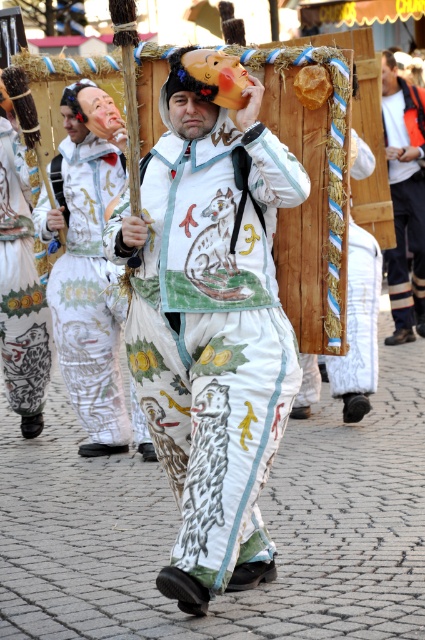
Looking at this image, you are a photographer at the festival, and you want to take a picture of the central figure in the white costume with the hooded cape. However, there is an orange reflective jacket at upper right blocking your view. Where should you move to avoid it?

Move to the lower left to avoid the orange reflective jacket at upper right, as it is located at point (405, 196) in the image.

In the scene shown: You are a photographer at the festival trying to capture the orange reflective jacket at upper right and the matte brown mask at upper center in a single shot. Which object should you focus on first to ensure both are in frame?

The orange reflective jacket at upper right is much taller than the matte brown mask at upper center, so you should focus on the orange reflective jacket at upper right first to ensure both fit within the frame.